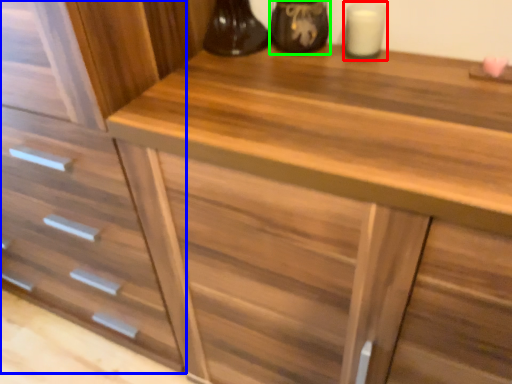
Question: Considering the real-world distances, which object is farthest from candle holder (highlighted by a red box)? drawer (highlighted by a blue box) or appliance (highlighted by a green box)?

Choices:
 (A) drawer
 (B) appliance

Answer: (A)